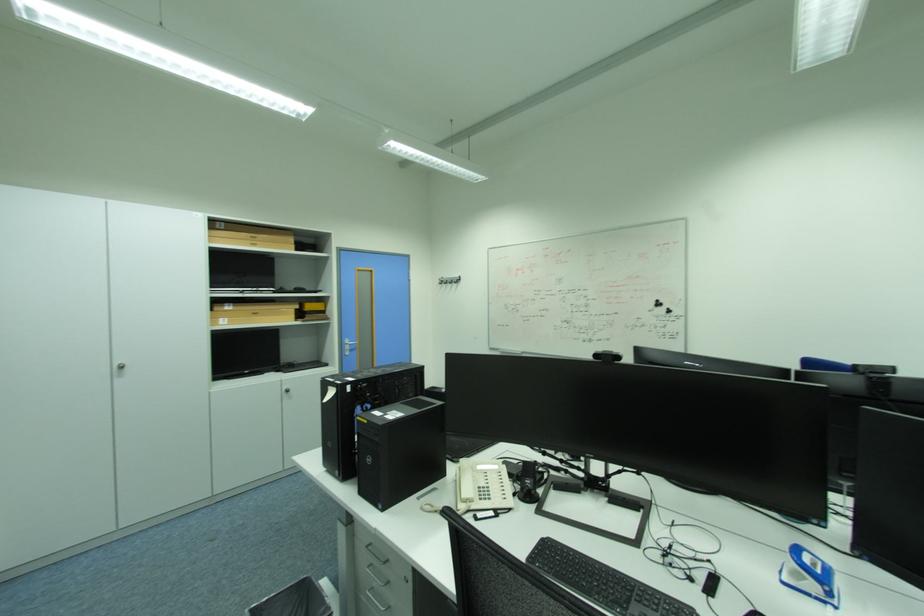
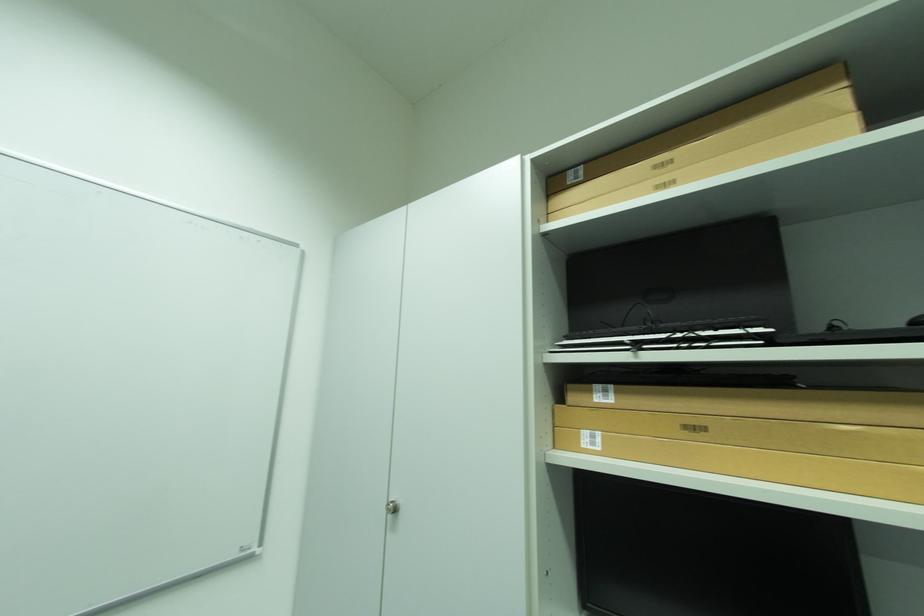
In the second image, find the point that corresponds to point (237, 306) in the first image.

(614, 392)